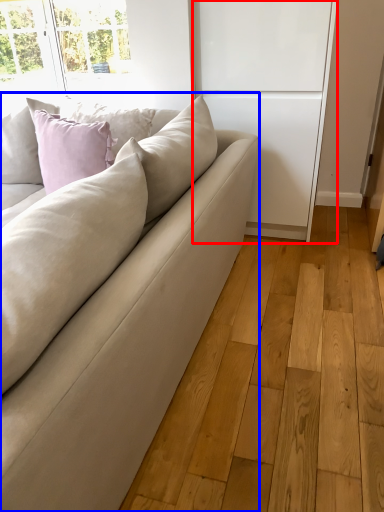
Question: Among these objects, which one is farthest to the camera, screen door (highlighted by a red box) or studio couch (highlighted by a blue box)?

Choices:
 (A) screen door
 (B) studio couch

Answer: (A)